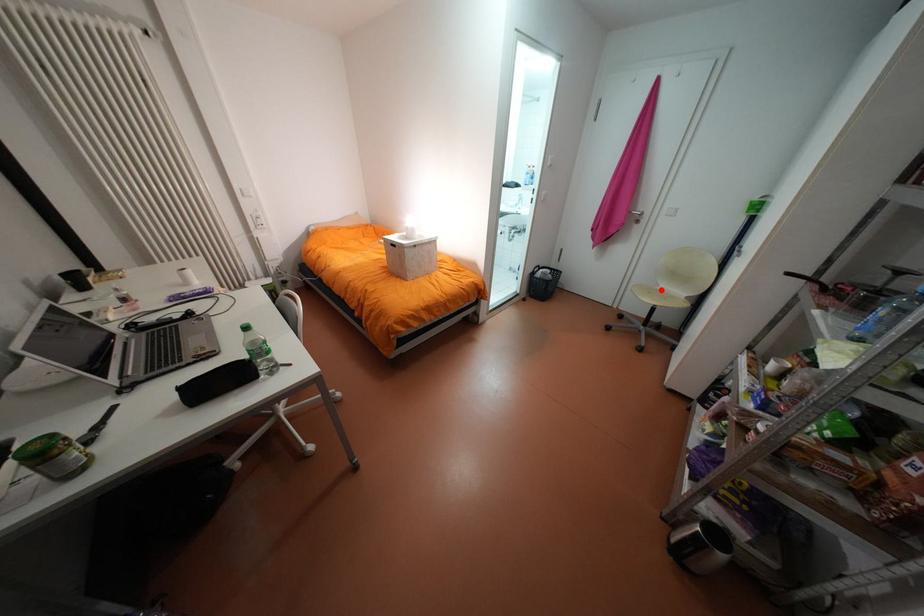
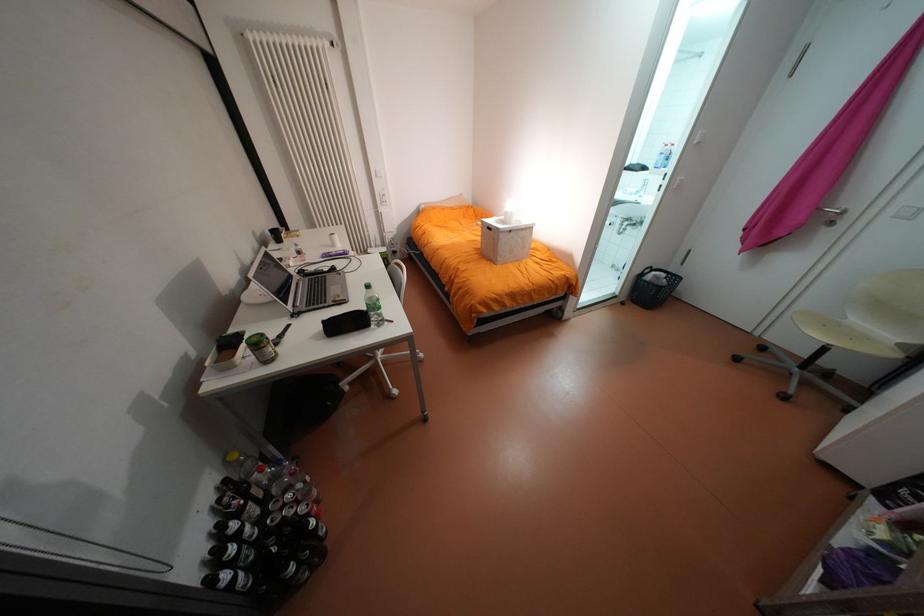
Question: I am providing you with two images of the same scene from different viewpoints. Given a red point in image1, look at the same physical point in image2. Is it:

Choices:
 (A) Closer to the viewpoint
 (B) Farther from the viewpoint

Answer: (B)